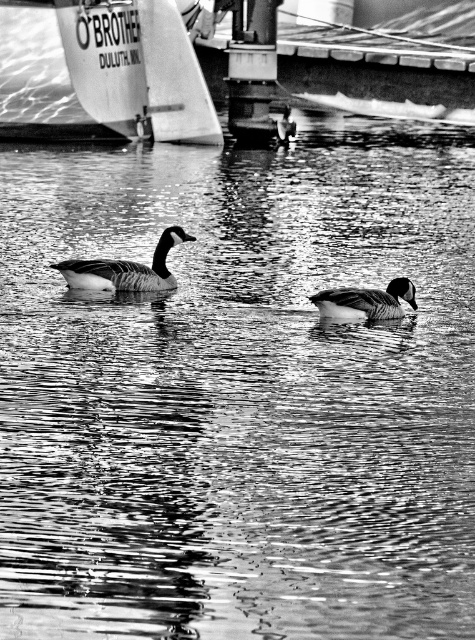
Question: Is white sailboat at upper left closer to the viewer compared to smooth gray duck at center?

Choices:
 (A) no
 (B) yes

Answer: (A)

Question: Which point is closer to the camera taking this photo?

Choices:
 (A) (188, 76)
 (B) (82, 276)

Answer: (B)

Question: Which object is positioned farthest from the white sailboat at upper left?

Choices:
 (A) dark gray matte duck at center
 (B) smooth gray duck at center

Answer: (B)

Question: Does white sailboat at upper left have a larger size compared to dark gray matte duck at center?

Choices:
 (A) no
 (B) yes

Answer: (B)

Question: Is dark gray matte duck at center to the right of smooth gray duck at center from the viewer's perspective?

Choices:
 (A) no
 (B) yes

Answer: (A)

Question: Which of the following is the closest to the observer?

Choices:
 (A) smooth gray duck at center
 (B) white sailboat at upper left
 (C) dark gray matte duck at center

Answer: (A)